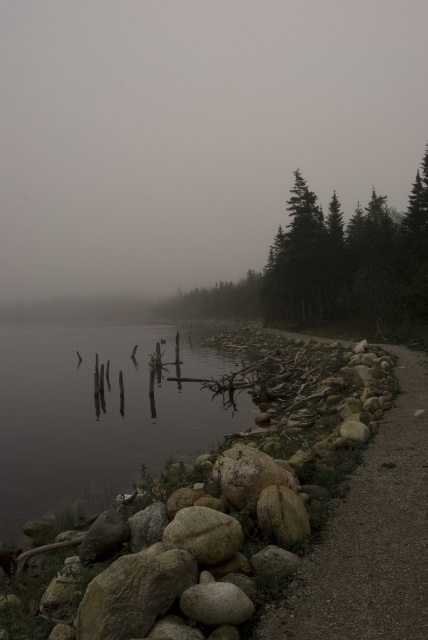
Question: Which object is the closest to the green matte trees at center?

Choices:
 (A) dark brown water at left
 (B) gravel path at lower right
 (C) smooth beige rock at lower center

Answer: (A)

Question: Is foggy mist at upper center positioned at the back of green matte trees at center?

Choices:
 (A) no
 (B) yes

Answer: (B)

Question: From the image, what is the correct spatial relationship of dark brown water at left in relation to smooth gray rock at lower center?

Choices:
 (A) left
 (B) right

Answer: (A)

Question: Is green matte trees at center further to camera compared to green matte tree at center?

Choices:
 (A) no
 (B) yes

Answer: (A)

Question: Estimate the real-world distances between objects in this image. Which object is farther from the dark brown water at left?

Choices:
 (A) gravel path at lower right
 (B) green matte tree at center
 (C) smooth gray rock at lower center

Answer: (B)

Question: Which is nearer to the dark brown water at left?

Choices:
 (A) smooth beige rock at lower center
 (B) gravel path at lower right
 (C) foggy mist at upper center
 (D) green matte trees at center

Answer: (A)